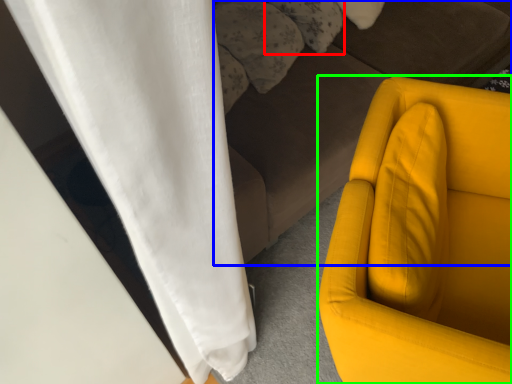
Question: Considering the real-world distances, which object is farthest from pillow (highlighted by a red box)? studio couch (highlighted by a blue box) or furniture (highlighted by a green box)?

Choices:
 (A) studio couch
 (B) furniture

Answer: (B)